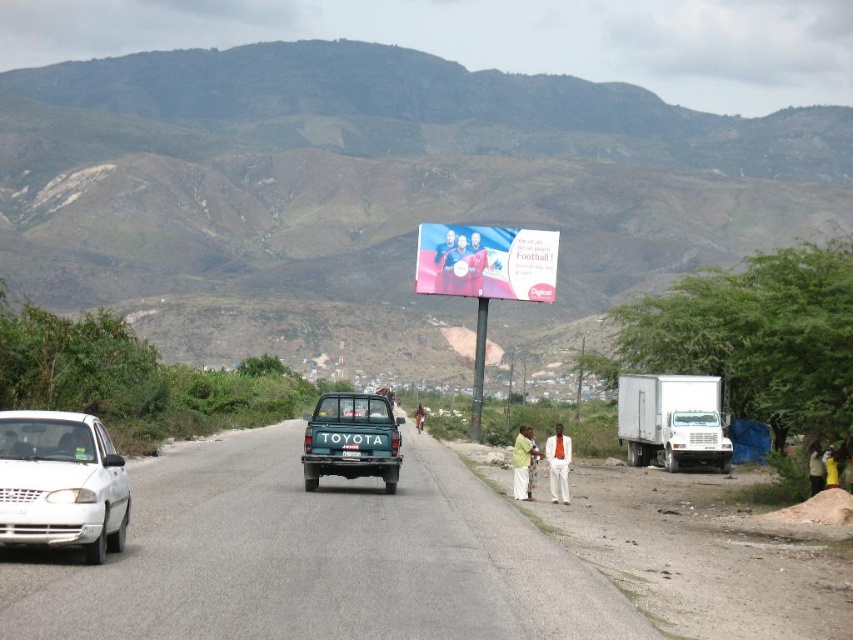
Question: Considering the real-world distances, which object is farthest from the blue fabric billboard at center?

Choices:
 (A) smooth plastic figure at center
 (B) light green fabric shirt at right
 (C) green matte license plate at center

Answer: (C)

Question: Among these points, which one is farthest from the camera?

Choices:
 (A) (450, 269)
 (B) (463, 280)
 (C) (618, 380)

Answer: (A)

Question: Is smooth leather jacket at center bigger than brown leather jacket at center?

Choices:
 (A) yes
 (B) no

Answer: (B)

Question: Does green matte toyota truck at center appear under smooth leather jacket at center?

Choices:
 (A) yes
 (B) no

Answer: (A)

Question: Which object is positioned farthest from the light green fabric shirt at right?

Choices:
 (A) white cotton pants at right
 (B) smooth plastic figure at center
 (C) smooth leather jacket at center
 (D) white matte truck at right

Answer: (C)

Question: Where is white matte sedan at left located in relation to blue fabric billboard at center in the image?

Choices:
 (A) left
 (B) right

Answer: (A)